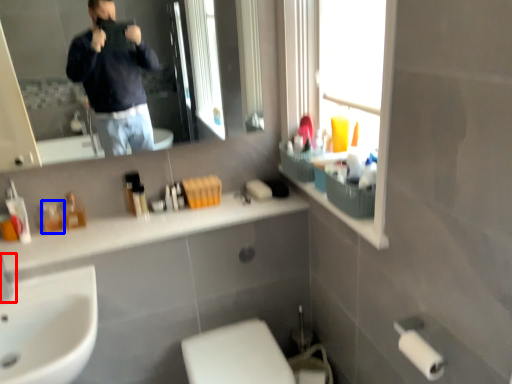
Question: Which point is closer to the camera, faucet (highlighted by a red box) or toiletry (highlighted by a blue box)?

Choices:
 (A) faucet
 (B) toiletry

Answer: (A)